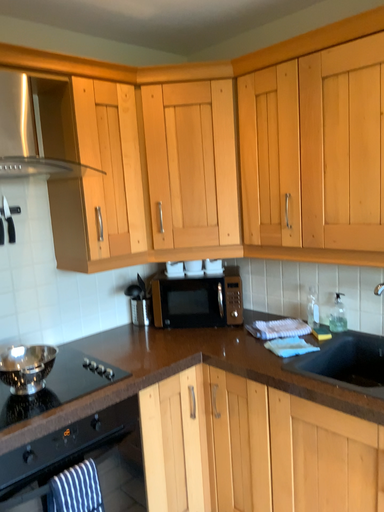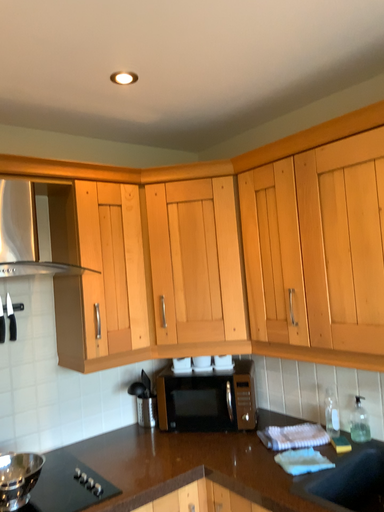
Question: Which way did the camera rotate in the video?

Choices:
 (A) rotated downward
 (B) rotated upward

Answer: (B)